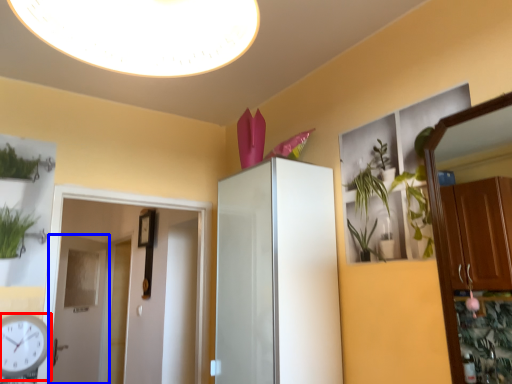
Question: Which of the following is the farthest to the observer, clock (highlighted by a red box) or door (highlighted by a blue box)?

Choices:
 (A) clock
 (B) door

Answer: (B)